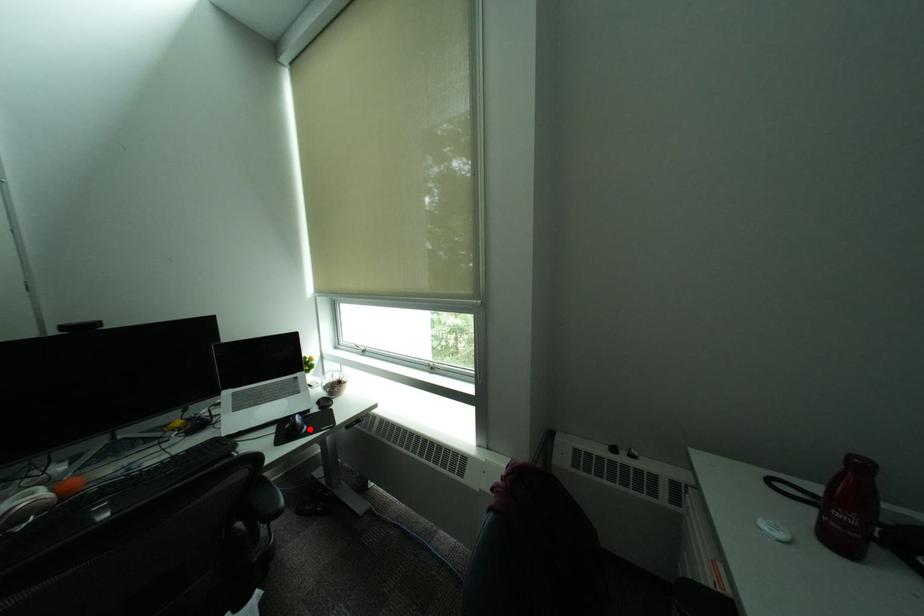
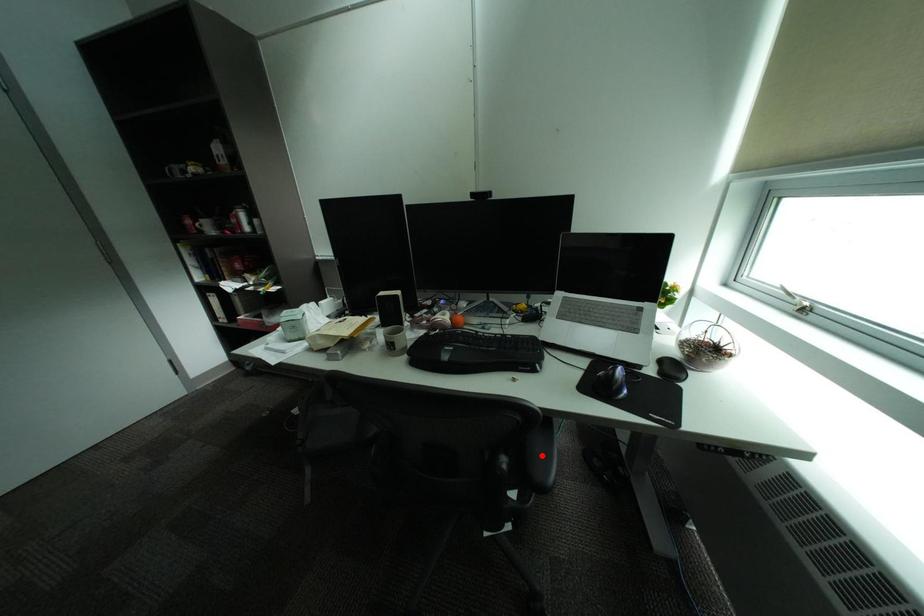
I am providing you with two images of the same scene from different viewpoints. A red point is marked on the first image and another point is marked on the second image. Are the points marked in image1 and image2 representing the same 3D position?

No